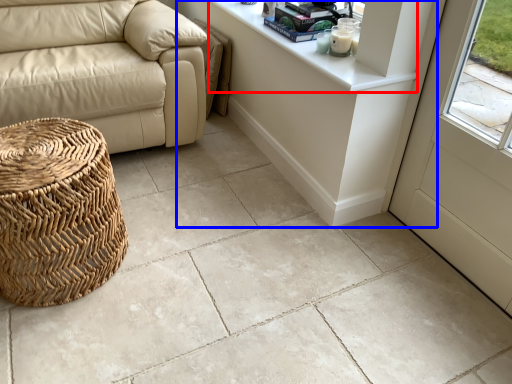
Question: Among these objects, which one is farthest to the camera, counter top (highlighted by a red box) or table (highlighted by a blue box)?

Choices:
 (A) counter top
 (B) table

Answer: (B)